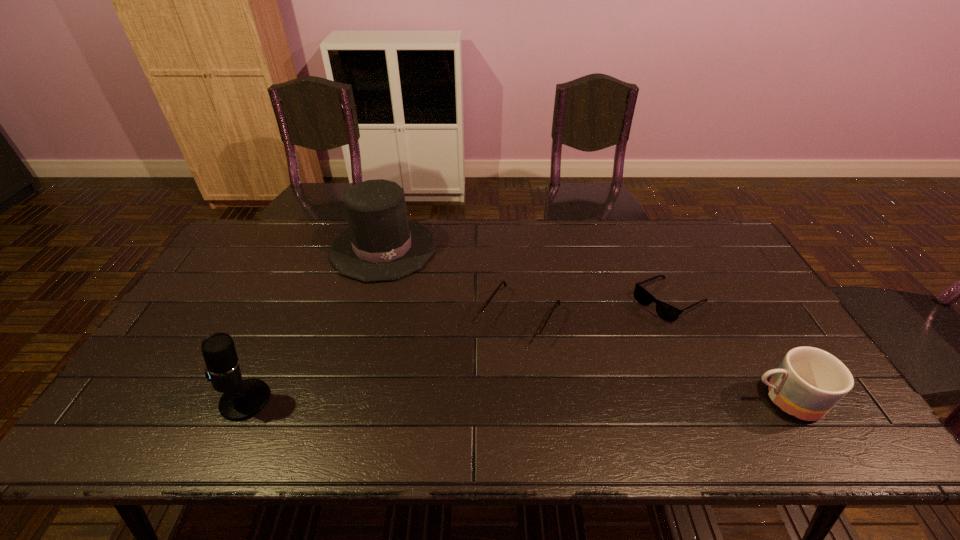
This screenshot has height=540, width=960. Find the location of `free spot between the microphone and the second object from left to right`. free spot between the microphone and the second object from left to right is located at coordinates (314, 325).

The height and width of the screenshot is (540, 960). What are the coordinates of `empty location between the spectacles and the mug` in the screenshot? It's located at (653, 357).

Identify the location of free space between the dress hat and the sunglasses. point(526,275).

The image size is (960, 540). I want to click on empty space between the dress hat and the third tallest object, so click(584, 324).

Where is `free space that is in between the sunglasses and the leftmost object`? free space that is in between the sunglasses and the leftmost object is located at coordinates (457, 350).

The height and width of the screenshot is (540, 960). Find the location of `free space between the mug and the microphone`. free space between the mug and the microphone is located at coordinates (515, 400).

Find the location of a particular element. The height and width of the screenshot is (540, 960). empty location between the third tallest object and the second object from left to right is located at coordinates (584, 324).

The height and width of the screenshot is (540, 960). I want to click on free space between the third object from right to left and the leftmost object, so pyautogui.click(x=383, y=358).

Where is `free spot between the third object from right to left and the second object from left to right`? The image size is (960, 540). free spot between the third object from right to left and the second object from left to right is located at coordinates (452, 282).

Identify which object is the closest to the third tallest object. Please provide its 2D coordinates. Your answer should be formatted as a tuple, i.e. [(x, y)], where the tuple contains the x and y coordinates of a point satisfying the conditions above.

[(665, 311)]